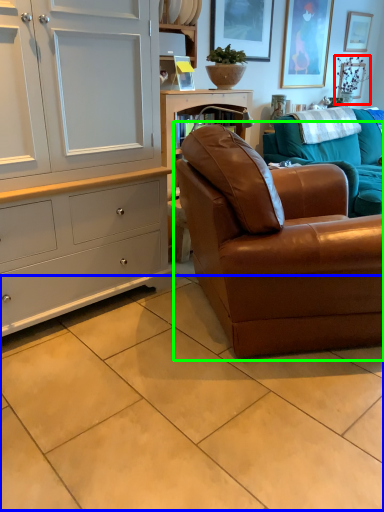
Question: Considering the real-world distances, which object is closest to plant (highlighted by a red box)? ceramic tile (highlighted by a blue box) or studio couch (highlighted by a green box).

Choices:
 (A) ceramic tile
 (B) studio couch

Answer: (B)